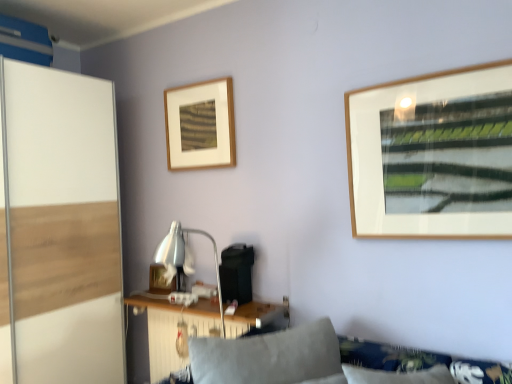
Question: Is white glossy screen door at left in front of or behind wooden table at lower center in the image?

Choices:
 (A) front
 (B) behind

Answer: (A)

Question: From a real-world perspective, is white glossy screen door at left above or below wooden table at lower center?

Choices:
 (A) above
 (B) below

Answer: (A)

Question: Estimate the real-world distances between objects in this image. Which object is closer to the white glossy screen door at left?

Choices:
 (A) wooden picture frame at upper center, arranged as the 2th picture frame when viewed from the back
 (B) wooden picture frame at center, which ranks as the second picture frame in top-to-bottom order
 (C) soft gray cushion at lower center
 (D) wooden table at lower center

Answer: (D)

Question: Which of these objects is positioned farthest from the white glossy screen door at left?

Choices:
 (A) wooden picture frame at upper center, arranged as the 2th picture frame when viewed from the back
 (B) wooden table at lower center
 (C) soft gray cushion at lower center
 (D) wooden picture frame at center, which ranks as the second picture frame in top-to-bottom order

Answer: (C)